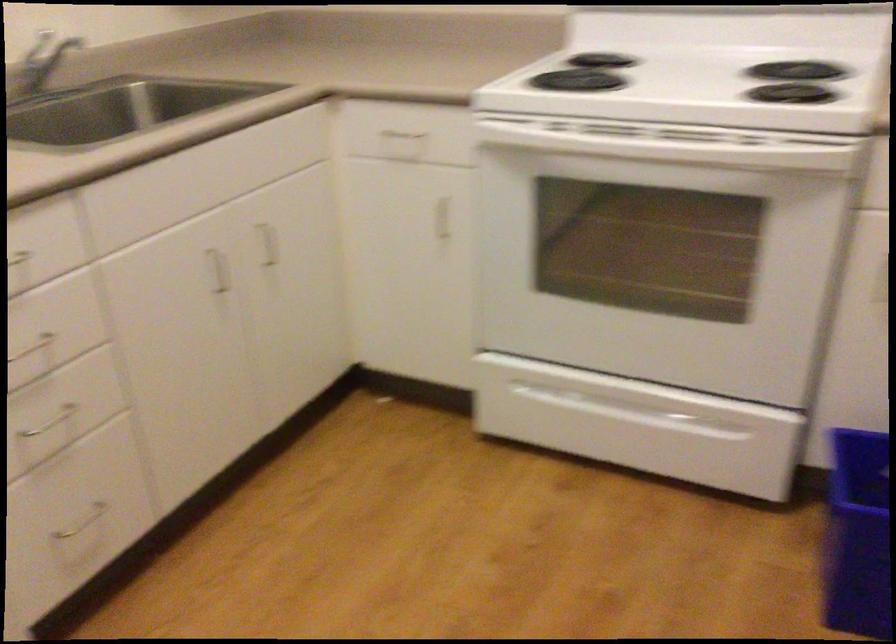
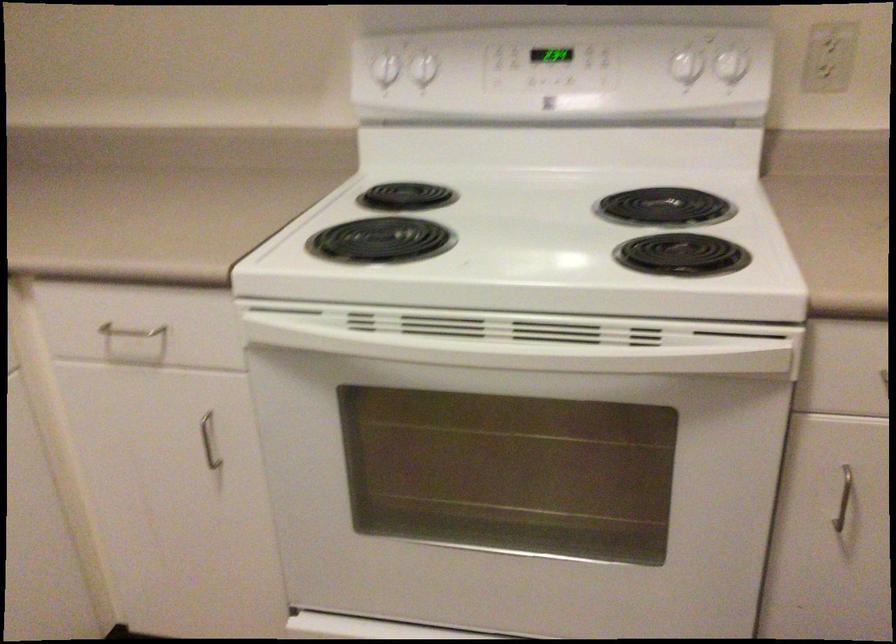
Locate, in the second image, the point that corresponds to pixel 796 71 in the first image.

(664, 207)